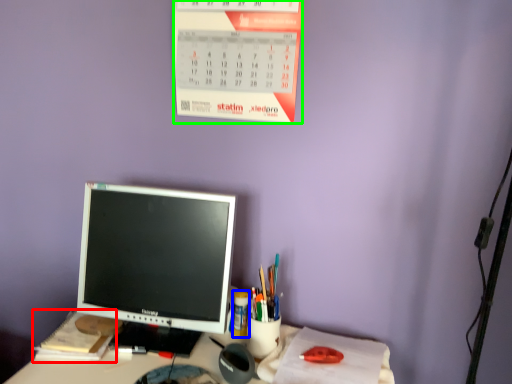
Question: Which object is positioned closest to notebook (highlighted by a red box)? Select from stationery (highlighted by a blue box) and calendar (highlighted by a green box).

Choices:
 (A) stationery
 (B) calendar

Answer: (A)